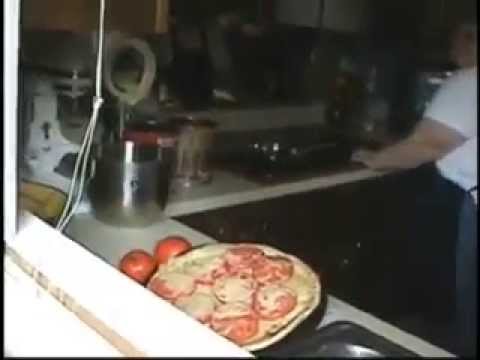
Find the location of a particular element. This screenshot has height=360, width=480. sink is located at coordinates (304, 162), (348, 352).